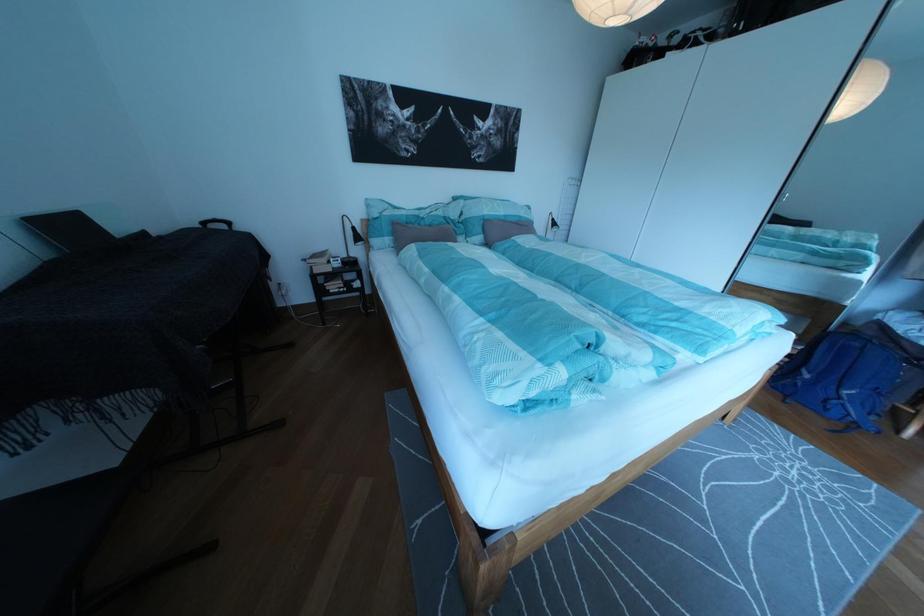
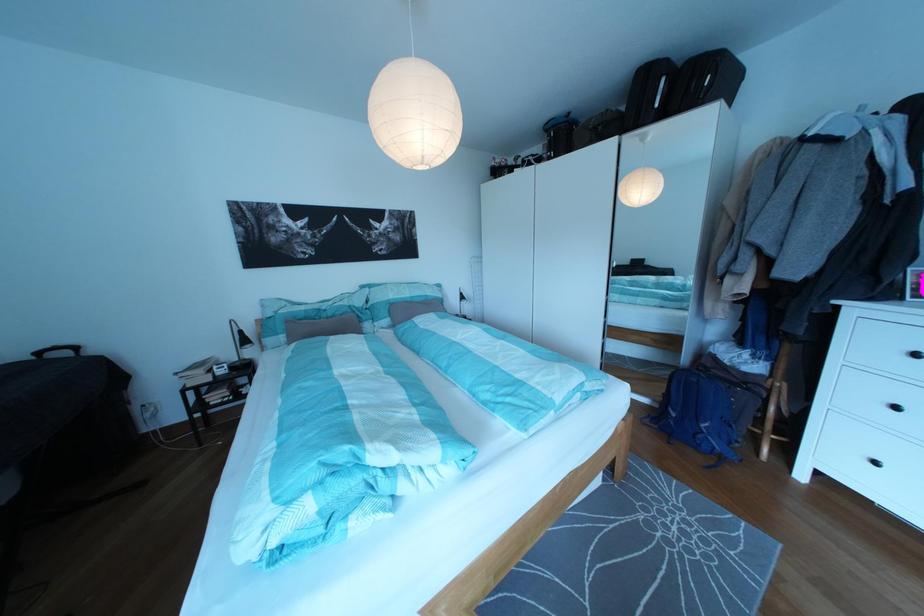
Find the pixel in the second image that matches (x=848, y=408) in the first image.

(713, 442)